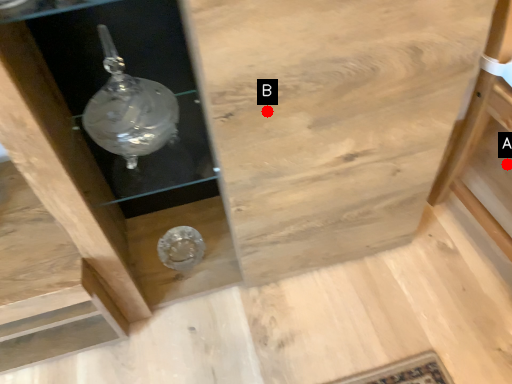
Question: Two points are circled on the image, labeled by A and B beside each circle. Which point is closer to the camera?

Choices:
 (A) A is closer
 (B) B is closer

Answer: (B)